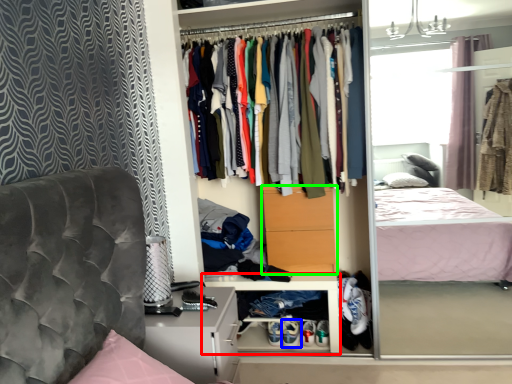
Question: Which object is positioned farthest from cabinet (highlighted by a red box)? Select from footwear (highlighted by a blue box) and drawer (highlighted by a green box).

Choices:
 (A) footwear
 (B) drawer

Answer: (A)